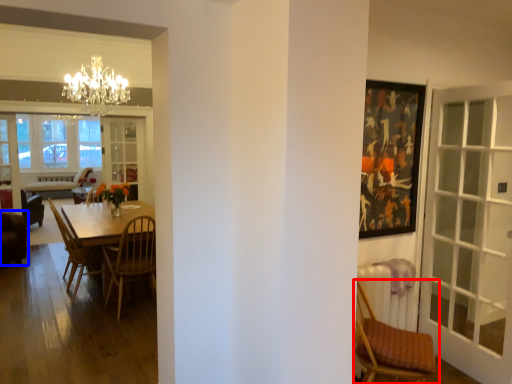
Question: Which object is further to the camera taking this photo, chair (highlighted by a red box) or chair (highlighted by a blue box)?

Choices:
 (A) chair
 (B) chair

Answer: (B)